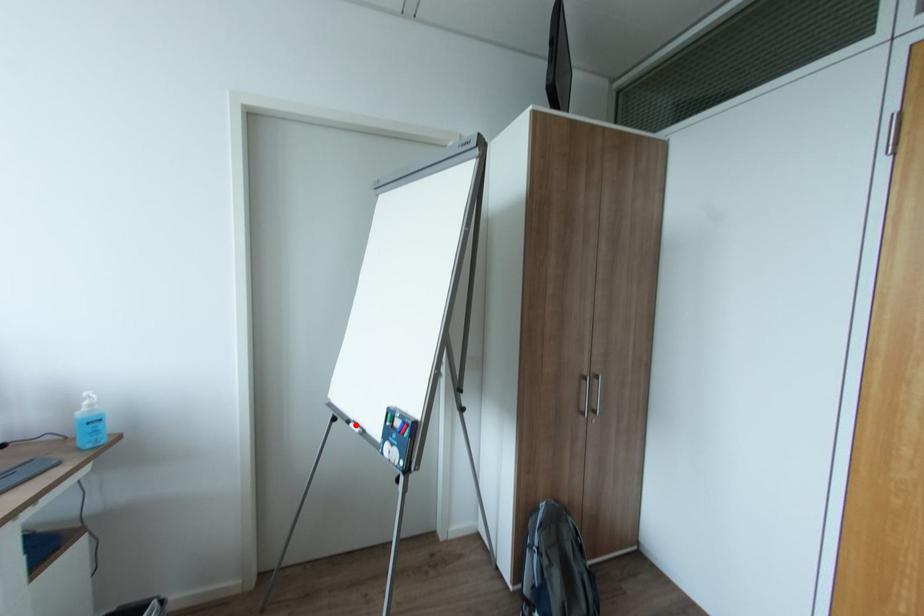
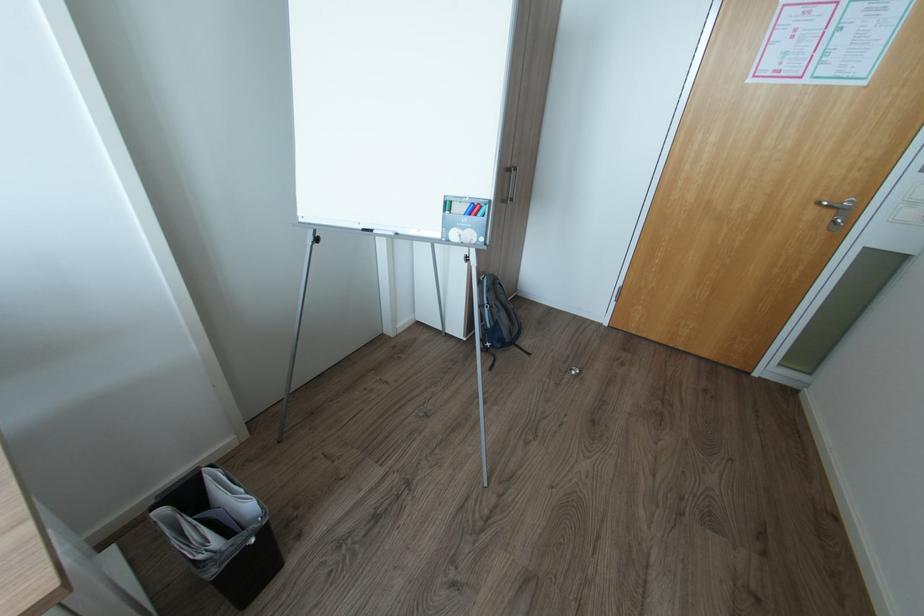
Question: A red point is marked in image1. In image2, is the corresponding 3D point closer to the camera or farther? Reply with the corresponding letter.

Choices:
 (A) The corresponding 3D point is closer.
 (B) The corresponding 3D point is farther.

Answer: (A)